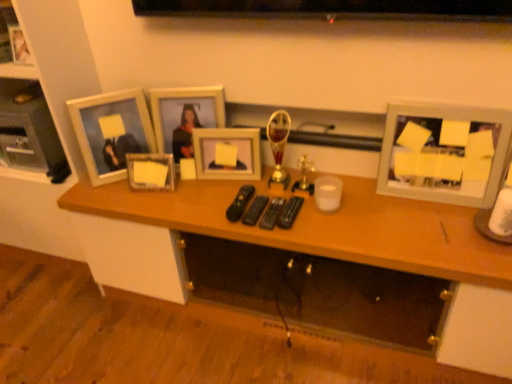
This screenshot has height=384, width=512. I want to click on unoccupied space behind black plastic remote at center, arranged as the fourth remote control when viewed from the right, so click(239, 183).